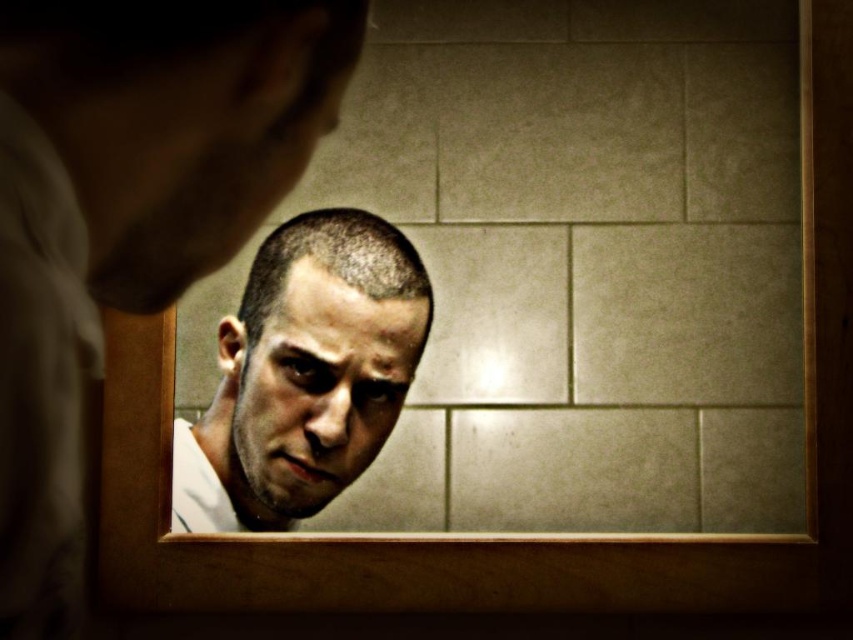
Looking at this image, you are standing in a bathroom with a mirror. You see a point at coordinates (128, 216). What is located at that point?

The point at coordinates (128, 216) indicates the smooth white shirt at upper left.

You are a skincare consultant assessing two faces in a mirror reflection. The smooth skin face at center and the shiny skin face at center are both visible. Which face has a greater width?

The smooth skin face at center has a greater width than the shiny skin face at center according to the description provided.

You are standing in a bathroom and notice a smooth white shirt at upper left and a smooth skin face at center. Which object is positioned higher in the image?

The smooth white shirt at upper left is positioned higher than the smooth skin face at center.